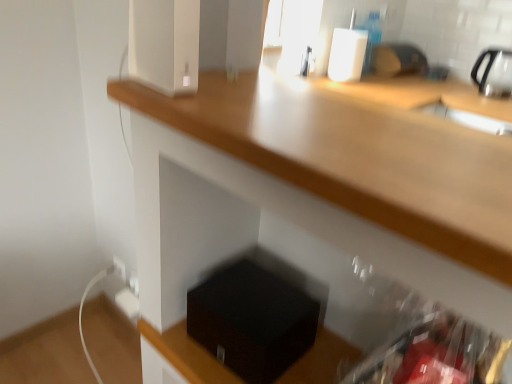
Question: Is black matte box at lower center smaller than white glossy speaker at upper center?

Choices:
 (A) no
 (B) yes

Answer: (A)

Question: Would you say black matte box at lower center contains white glossy speaker at upper center?

Choices:
 (A) yes
 (B) no

Answer: (B)

Question: Is black matte box at lower center facing away from white glossy speaker at upper center?

Choices:
 (A) yes
 (B) no

Answer: (B)

Question: Is black matte box at lower center facing towards white glossy speaker at upper center?

Choices:
 (A) no
 (B) yes

Answer: (A)

Question: Considering the relative sizes of black matte box at lower center and white glossy speaker at upper center in the image provided, is black matte box at lower center taller than white glossy speaker at upper center?

Choices:
 (A) yes
 (B) no

Answer: (B)

Question: Can you confirm if black matte box at lower center is bigger than white glossy speaker at upper center?

Choices:
 (A) yes
 (B) no

Answer: (A)

Question: Is white glossy speaker at upper center to the left of black matte box at lower center from the viewer's perspective?

Choices:
 (A) yes
 (B) no

Answer: (A)

Question: From a real-world perspective, is white glossy speaker at upper center under black matte box at lower center?

Choices:
 (A) no
 (B) yes

Answer: (A)

Question: Is white glossy speaker at upper center at the right side of black matte box at lower center?

Choices:
 (A) yes
 (B) no

Answer: (B)

Question: Does white glossy speaker at upper center have a greater height compared to black matte box at lower center?

Choices:
 (A) yes
 (B) no

Answer: (A)

Question: Is black matte box at lower center a part of white glossy speaker at upper center?

Choices:
 (A) yes
 (B) no

Answer: (B)

Question: Is white glossy speaker at upper center positioned far away from black matte box at lower center?

Choices:
 (A) yes
 (B) no

Answer: (B)

Question: Is white glossy speaker at upper center in front of or behind black matte box at lower center in the image?

Choices:
 (A) behind
 (B) front

Answer: (B)